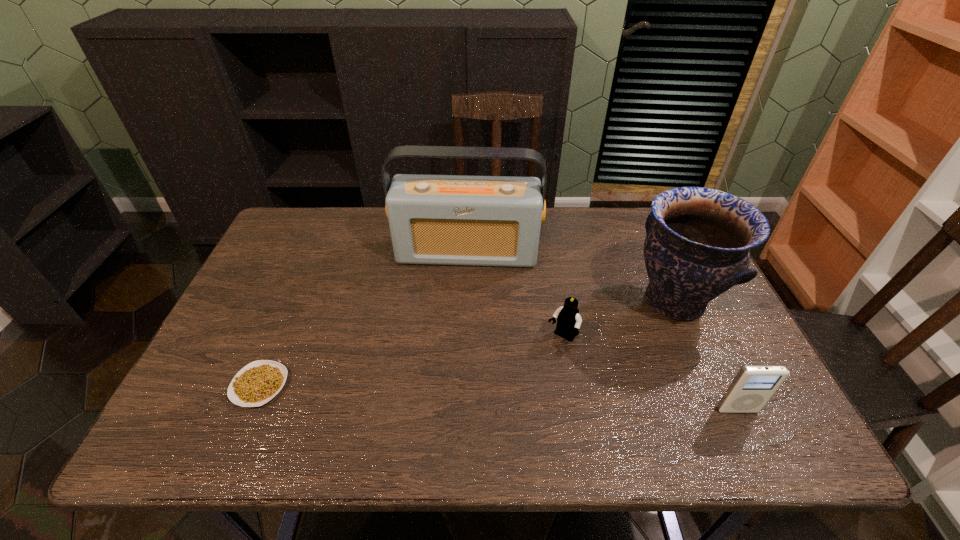
I want to click on vacant spot on the desktop that is between the legume and the iPod and is positioned on the front-facing side of the radio receiver, so click(453, 395).

Identify the location of free space on the desktop that is between the legume and the iPod and is positioned on the front-facing side of the fourth tallest object. The height and width of the screenshot is (540, 960). (517, 399).

The width and height of the screenshot is (960, 540). Find the location of `free space on the desktop that is between the leftmost object and the third shortest object and is positioned on the front handle of the pottery`. free space on the desktop that is between the leftmost object and the third shortest object and is positioned on the front handle of the pottery is located at coordinates (480, 397).